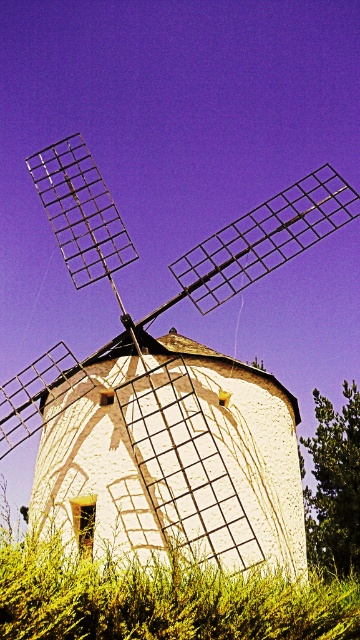
You are standing in front of the windmill and want to walk towards the green leafy grass at lower center. Which direction should you move relative to the white matte windmill at center?

You should move to the right relative to the white matte windmill at center because the green leafy grass at lower center is located to the left of the windmill, so moving right from the windmill would lead you towards it.

You are standing at the center of the image. Which direction should you move to reach the white matte windmill at center?

Since the white matte windmill at center is located at point coordinates of (167,388), you should move to the right and slightly downward from the center to reach it.

You are a drone operator planning to fly your drone from the white matte windmill at center to the green leafy grass at lower center. Given that your drone has a maximum flight range of 30 feet, will it be able to reach the grass without needing to recharge?

The white matte windmill at center and green leafy grass at lower center are 35.30 feet apart. Since the distance exceeds the drone s 30 feet range, the drone cannot reach the green leafy grass at lower center without recharging.